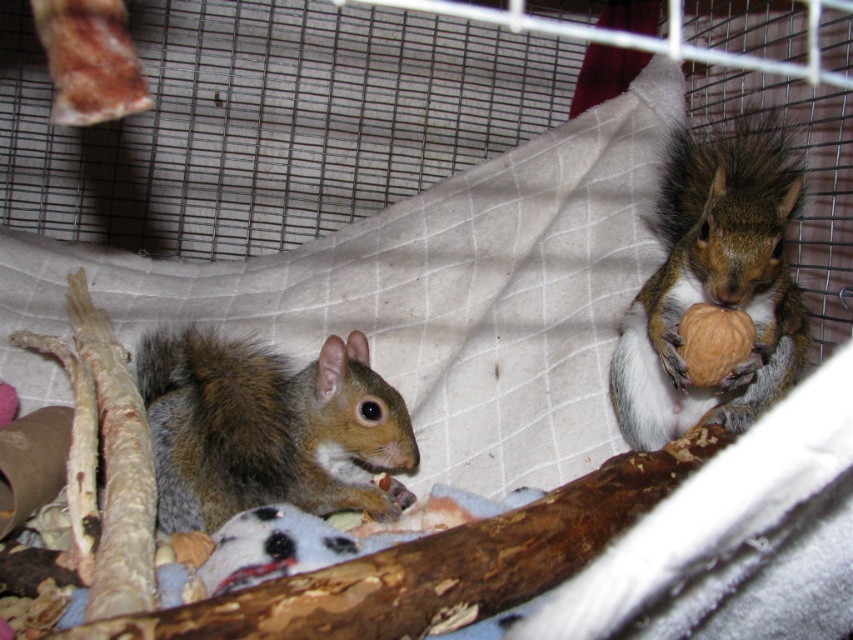
Who is more forward, (x=635, y=388) or (x=393, y=419)?

Point (x=635, y=388)

Can you confirm if shiny brown fur at right is positioned to the right of brown fuzzy squirrel at center?

Indeed, shiny brown fur at right is positioned on the right side of brown fuzzy squirrel at center.

The height and width of the screenshot is (640, 853). Find the location of `shiny brown fur at right`. shiny brown fur at right is located at coordinates (715, 282).